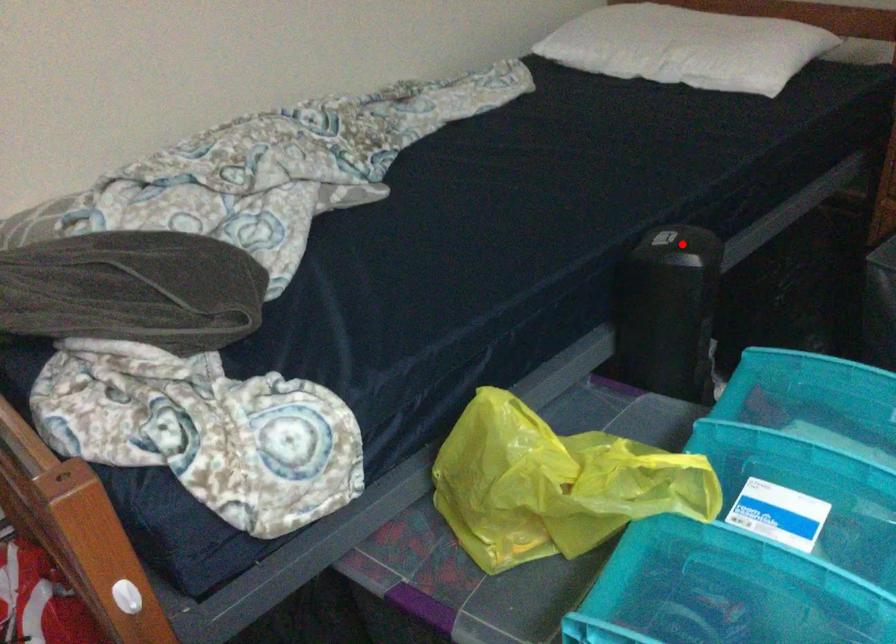
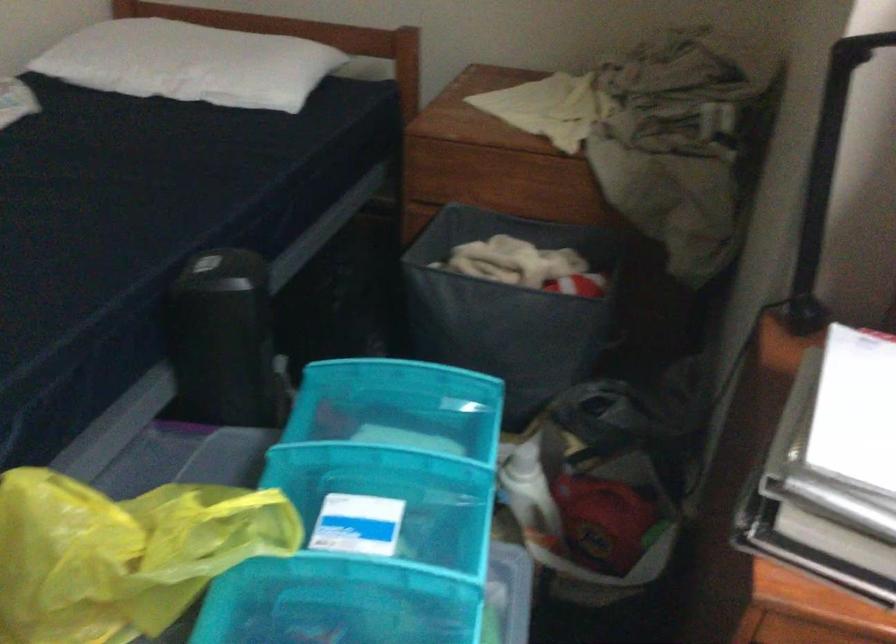
In the second image, find the point that corresponds to the highlighted location in the first image.

(225, 268)